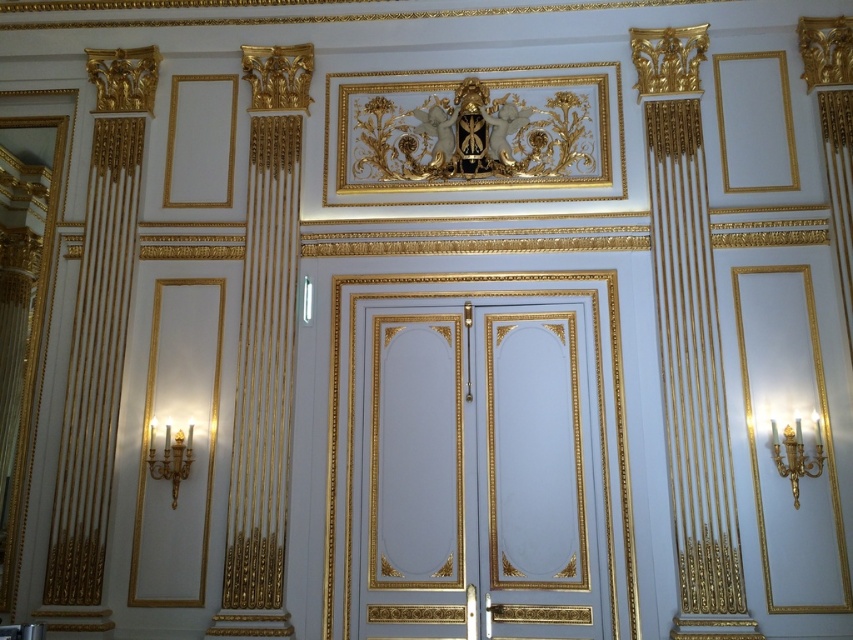
Between point (791, 467) and point (190, 435), which one is positioned in front?

Point (791, 467) is in front.

Is point (799, 452) positioned in front of point (173, 484)?

Yes, it is in front of point (173, 484).

Is point (810, 465) in front of point (184, 448)?

Yes, point (810, 465) is closer to viewer.

Locate an element on the screen. gold metallic chandelier at right is located at coordinates (796, 454).